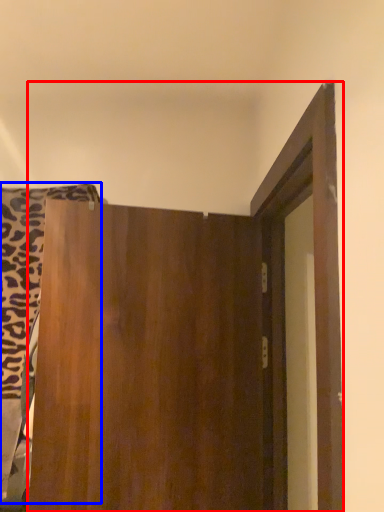
Question: Which point is closer to the camera, door (highlighted by a red box) or laundry (highlighted by a blue box)?

Choices:
 (A) door
 (B) laundry

Answer: (A)